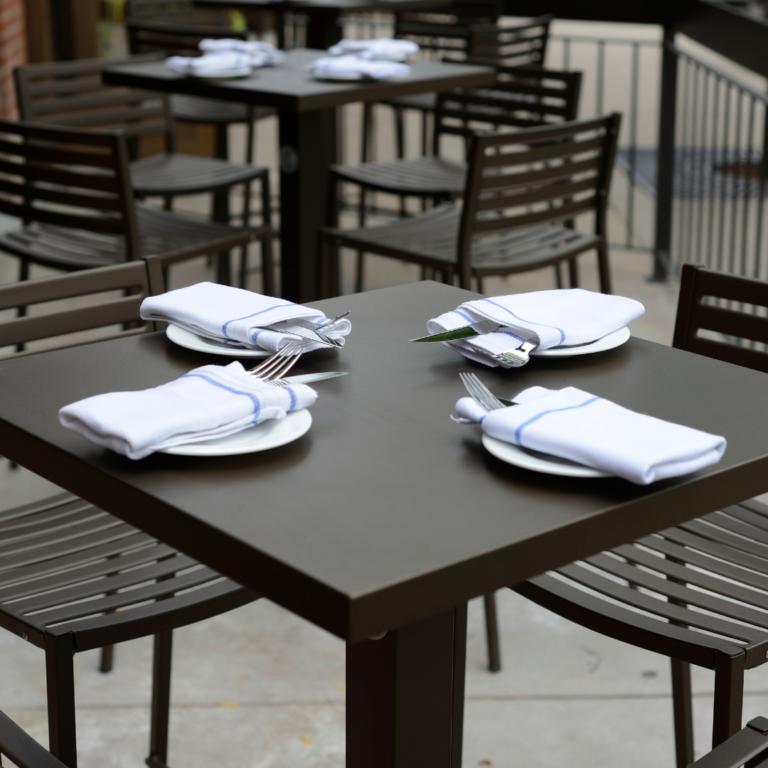
Identify the location of chairs. This screenshot has width=768, height=768. (45, 616), (699, 594), (750, 740), (531, 173), (518, 118), (492, 38), (437, 38), (190, 37), (68, 81), (78, 177).